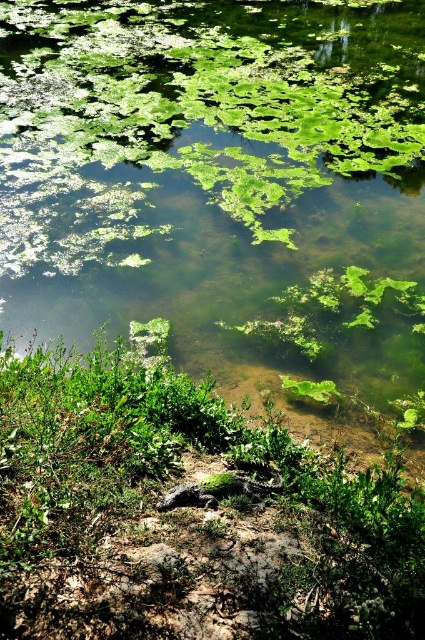
Who is shorter, green algae at bottom or green leafy plant at center?

With less height is green leafy plant at center.

Between point (416, 240) and point (365, 545), which one is positioned behind?

The point (416, 240) is more distant.

Describe the element at coordinates (221, 180) in the screenshot. This screenshot has height=640, width=425. I see `green algae at bottom` at that location.

The width and height of the screenshot is (425, 640). I want to click on green algae at bottom, so click(221, 180).